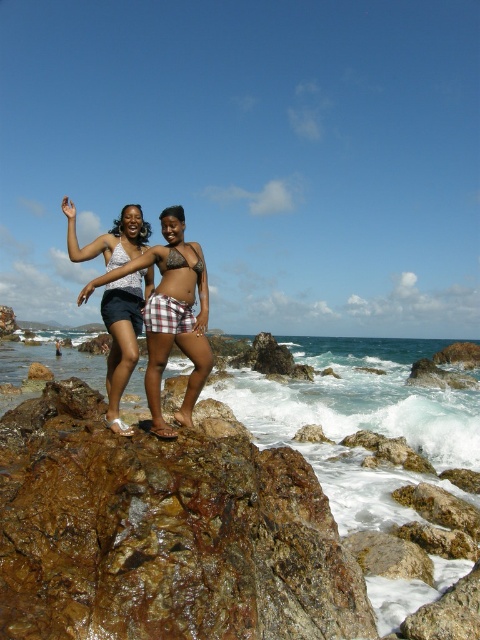
You are a photographer trying to capture a photo of the white matte bikini top at center and the brown skin at center. How far apart are these two elements in the image?

The white matte bikini top at center and the brown skin at center are 7.08 meters apart from each other.

You are a photographer trying to capture a clear shot of the white matte bikini top at center and the brown skin at center. Which one is closer to the camera?

The white matte bikini top at center is in front of brown skin at center, so it is closer to the camera.